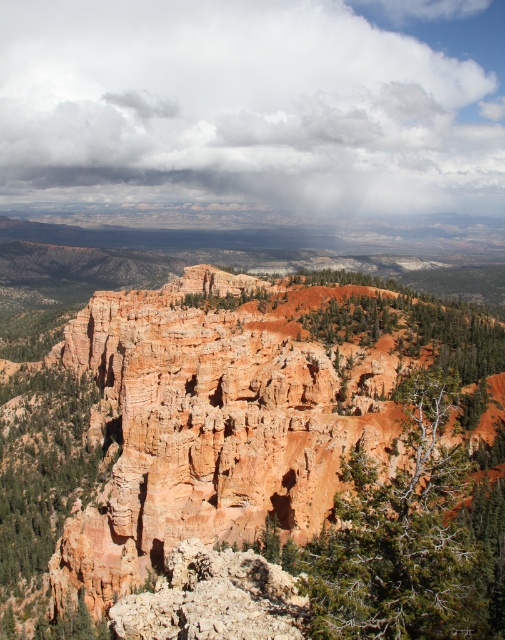
Question: Which of the following is the farthest from the observer?

Choices:
 (A) (217, 563)
 (B) (27, 481)

Answer: (B)

Question: Is rusty rock formation at center bigger than green matte tree at center?

Choices:
 (A) yes
 (B) no

Answer: (A)

Question: Which of the following is the closest to the observer?

Choices:
 (A) (391, 49)
 (B) (335, 340)
 (C) (22, 442)

Answer: (B)

Question: Is green textured rock at left to the left of green matte tree at center from the viewer's perspective?

Choices:
 (A) yes
 (B) no

Answer: (A)

Question: Is green textured tree at center thinner than green textured rock at left?

Choices:
 (A) yes
 (B) no

Answer: (A)

Question: Which object is positioned farthest from the green textured tree at center?

Choices:
 (A) cloudy white cloud at upper center
 (B) green matte tree at center
 (C) green textured rock at left

Answer: (A)